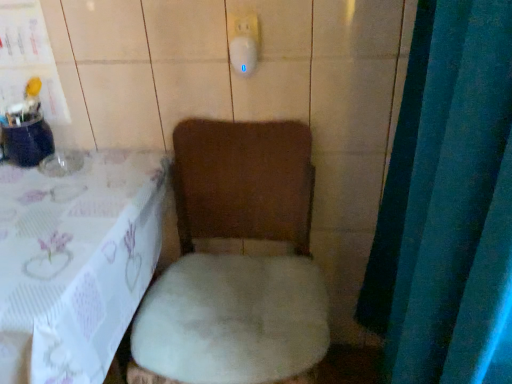
You are a GUI agent. You are given a task and a screenshot of the screen. Output one action in this format:
    pyautogui.click(x=<x>, y=<y>)
    Task: Click on the blue fabric curtain at right
    The width and height of the screenshot is (512, 384).
    Given the screenshot: What is the action you would take?
    pyautogui.click(x=448, y=205)

Identify the location of white plush toilet at center. click(x=237, y=261).

From a real-world perspective, is white plush toilet at center positioned above or below white plush chair at lower left?

From a real-world perspective, white plush toilet at center is physically above white plush chair at lower left.

What's the angular difference between white plush toilet at center and white plush chair at lower left's facing directions?

white plush toilet at center and white plush chair at lower left are facing 0.288 degrees away from each other.

Considering the relative sizes of white plush toilet at center and white plush chair at lower left in the image provided, is white plush toilet at center shorter than white plush chair at lower left?

No.

Who is bigger, white plush toilet at center or white plush chair at lower left?

white plush chair at lower left.

Choose the correct answer: Is white plush chair at lower left inside white plush toilet at center or outside it?

white plush chair at lower left is located beyond the bounds of white plush toilet at center.

Is point (17, 264) positioned before point (205, 234)?

Yes, point (17, 264) is in front of point (205, 234).

How different are the orientations of white plush chair at lower left and white plush toilet at center in degrees?

There is a 0.288-degree angle between the facing directions of white plush chair at lower left and white plush toilet at center.

From the picture: Considering the sizes of objects white plush chair at lower left and white plush toilet at center in the image provided, who is shorter, white plush chair at lower left or white plush toilet at center?

Standing shorter between the two is white plush chair at lower left.

Is blue fabric curtain at right bigger or smaller than white plush toilet at center?

Clearly, blue fabric curtain at right is smaller in size than white plush toilet at center.

Between blue fabric curtain at right and white plush toilet at center, which one has smaller width?

With smaller width is blue fabric curtain at right.

Between blue fabric curtain at right and white plush toilet at center, which one has more height?

With more height is blue fabric curtain at right.

Is blue fabric curtain at right to the left or to the right of white plush toilet at center in the image?

blue fabric curtain at right is to the right of white plush toilet at center.

Locate an element on the screen. This screenshot has width=512, height=384. curtain located above the white plush chair at lower left (from a real-world perspective) is located at coordinates (448, 205).

From the image's perspective, between blue fabric curtain at right and white plush chair at lower left, which one is located above?

From the image's view, blue fabric curtain at right is above.

Which of these two, blue fabric curtain at right or white plush chair at lower left, stands shorter?

Standing shorter between the two is white plush chair at lower left.

Considering the positions of objects blue fabric curtain at right and white plush chair at lower left in the image provided, who is more to the right, blue fabric curtain at right or white plush chair at lower left?

blue fabric curtain at right.

How different are the orientations of white plush toilet at center and blue fabric curtain at right in degrees?

The facing directions of white plush toilet at center and blue fabric curtain at right are 90 degrees apart.

Is blue fabric curtain at right completely or partially inside white plush toilet at center?

That's incorrect, blue fabric curtain at right is not inside white plush toilet at center.

From a real-world perspective, which object stands above the other?

From a 3D spatial view, blue fabric curtain at right is above.

Does white plush toilet at center turn towards blue fabric curtain at right?

No, white plush toilet at center is not turned towards blue fabric curtain at right.

Measure the distance between white plush chair at lower left and blue fabric curtain at right.

The distance of white plush chair at lower left from blue fabric curtain at right is 25.41 inches.

Is white plush chair at lower left looking in the opposite direction of blue fabric curtain at right?

white plush chair at lower left does not have its back to blue fabric curtain at right.

Is point (70, 198) farther from camera compared to point (388, 344)?

That is True.

At what (x,y) coordinates should I click in order to perform the action: click on toilet above the white plush chair at lower left (from a real-world perspective). Please return your answer as a coordinate pair (x, y). The height and width of the screenshot is (384, 512). Looking at the image, I should click on (237, 261).

Find the location of a particular element. This screenshot has width=512, height=384. furniture located below the white plush toilet at center (from the image's perspective) is located at coordinates (76, 263).

Based on their spatial positions, is blue fabric curtain at right or white plush chair at lower left closer to white plush toilet at center?

The object closer to white plush toilet at center is white plush chair at lower left.

Estimate the real-world distances between objects in this image. Which object is closer to white plush chair at lower left, blue fabric curtain at right or white plush toilet at center?

white plush toilet at center is positioned closer to the anchor white plush chair at lower left.

Which object lies further to the anchor point white plush chair at lower left, white plush toilet at center or blue fabric curtain at right?

blue fabric curtain at right is further to white plush chair at lower left.

When comparing their distances from blue fabric curtain at right, does white plush toilet at center or white plush chair at lower left seem further?

Based on the image, white plush chair at lower left appears to be further to blue fabric curtain at right.

Estimate the real-world distances between objects in this image. Which object is further from blue fabric curtain at right, white plush chair at lower left or white plush toilet at center?

white plush chair at lower left lies further to blue fabric curtain at right than the other object.

Which object lies further to the anchor point white plush toilet at center, white plush chair at lower left or blue fabric curtain at right?

Among the two, blue fabric curtain at right is located further to white plush toilet at center.

Locate an element on the screen. toilet between white plush chair at lower left and blue fabric curtain at right is located at coordinates (237, 261).